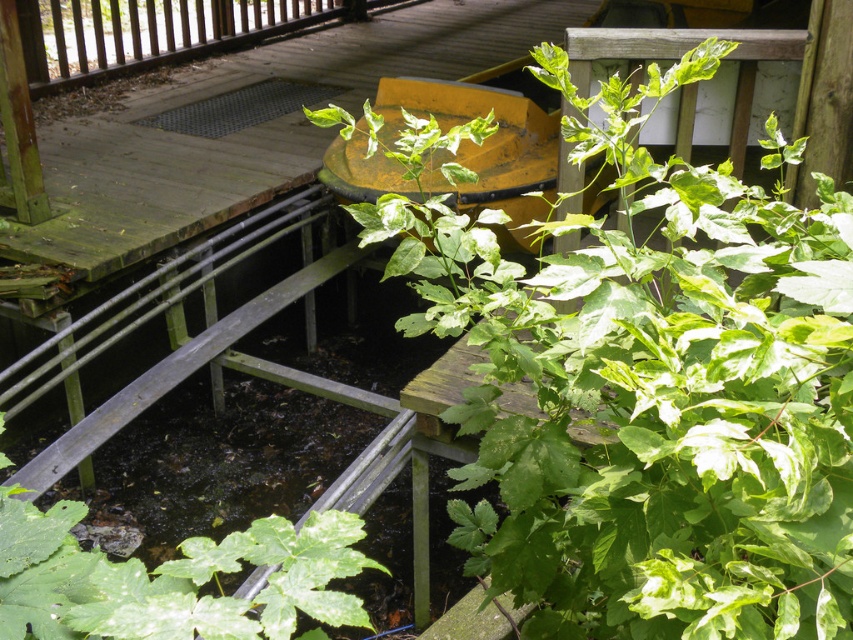
Consider the image. Does green leafy plant at center have a lesser width compared to green matte leafy plant at lower left?

No, green leafy plant at center is not thinner than green matte leafy plant at lower left.

Find the location of a particular element. The image size is (853, 640). green leafy plant at center is located at coordinates (653, 394).

Is point (465, 433) farther from camera compared to point (265, 531)?

That is True.

At what (x,y) coordinates should I click in order to perform the action: click on green leafy plant at center. Please return your answer as a coordinate pair (x, y). Image resolution: width=853 pixels, height=640 pixels. Looking at the image, I should click on (653, 394).